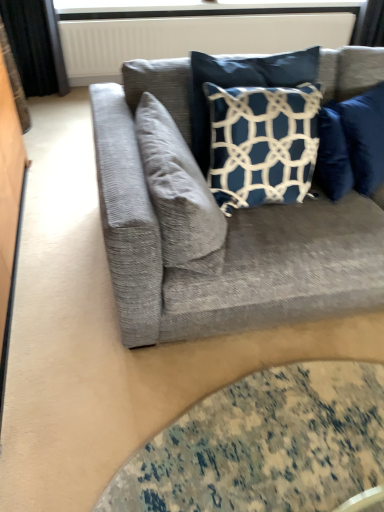
What are the coordinates of `white textured pillow at center, marked as the second pillow in a right-to-left arrangement` in the screenshot? It's located at (179, 193).

Measure the distance between point (205, 216) and camera.

Point (205, 216) and camera are 4.26 feet apart from each other.

Identify the location of textured gray couch at center. The image size is (384, 512). (226, 240).

Image resolution: width=384 pixels, height=512 pixels. Find the location of `navy blue fabric pillow at upper right, which is counted as the second pillow, starting from the left`. navy blue fabric pillow at upper right, which is counted as the second pillow, starting from the left is located at coordinates (240, 85).

Looking at this image, is white plastic window screen at upper center not inside textured gray couch at center?

Indeed, white plastic window screen at upper center is completely outside textured gray couch at center.

Is white plastic window screen at upper center looking in the opposite direction of textured gray couch at center?

No, textured gray couch at center is not at the back of white plastic window screen at upper center.

Considering the positions of points (309, 8) and (329, 289), is point (309, 8) farther from camera compared to point (329, 289)?

Yes, point (309, 8) is behind point (329, 289).

Is white textured pillow at center, marked as the second pillow in a right-to-left arrangement, taller or shorter than white textured radiator at upper center?

white textured pillow at center, marked as the second pillow in a right-to-left arrangement, is shorter than white textured radiator at upper center.

Is white textured pillow at center, marked as the second pillow in a right-to-left arrangement, in contact with white textured radiator at upper center?

They are not placed beside each other.

Which object is positioned more to the right, white textured pillow at center, marked as the second pillow in a right-to-left arrangement, or white textured radiator at upper center?

white textured radiator at upper center.

Is point (204, 233) positioned after point (196, 42)?

No, it is in front of (196, 42).

From a real-world perspective, who is located lower, textured gray couch at center or navy blue fabric pillow at upper right, which is counted as the second pillow, starting from the left?

textured gray couch at center is physically lower.

Looking at their sizes, would you say textured gray couch at center is wider or thinner than navy blue fabric pillow at upper right, marked as the first pillow in a right-to-left arrangement?

In the image, textured gray couch at center appears to be wider than navy blue fabric pillow at upper right, marked as the first pillow in a right-to-left arrangement.

You are a GUI agent. You are given a task and a screenshot of the screen. Output one action in this format:
    pyautogui.click(x=<x>, y=<y>)
    Task: Click on the pillow above the textured gray couch at center (from the image's perspective)
    This screenshot has height=512, width=384.
    Given the screenshot: What is the action you would take?
    pyautogui.click(x=240, y=85)

Considering the sizes of objects textured gray couch at center and navy blue fabric pillow at upper right, which is counted as the second pillow, starting from the left, in the image provided, who is taller, textured gray couch at center or navy blue fabric pillow at upper right, which is counted as the second pillow, starting from the left,?

textured gray couch at center.

Are white textured pillow at center, marked as the second pillow in a right-to-left arrangement, and black fabric curtain at left located far from each other?

Absolutely, white textured pillow at center, marked as the second pillow in a right-to-left arrangement, is distant from black fabric curtain at left.

From a real-world perspective, is white textured pillow at center, marked as the second pillow in a right-to-left arrangement, physically below black fabric curtain at left?

No, from a real-world perspective, white textured pillow at center, marked as the second pillow in a right-to-left arrangement, is not under black fabric curtain at left.

Is white textured pillow at center, positioned as the 1th pillow in left-to-right order, bigger than black fabric curtain at left?

Actually, white textured pillow at center, positioned as the 1th pillow in left-to-right order, might be smaller than black fabric curtain at left.

Is white textured pillow at center, marked as the second pillow in a right-to-left arrangement, oriented away from black fabric curtain at left?

No, white textured pillow at center, marked as the second pillow in a right-to-left arrangement, is not facing the opposite direction of black fabric curtain at left.

From the image's perspective, is white textured pillow at center, positioned as the 1th pillow in left-to-right order, located beneath transparent glass table at lower center?

Actually, white textured pillow at center, positioned as the 1th pillow in left-to-right order, appears above transparent glass table at lower center in the image.

Is white textured pillow at center, marked as the second pillow in a right-to-left arrangement, oriented towards transparent glass table at lower center?

No, white textured pillow at center, marked as the second pillow in a right-to-left arrangement, is not turned towards transparent glass table at lower center.

Based on the photo, in terms of height, does white textured pillow at center, marked as the second pillow in a right-to-left arrangement, look taller or shorter compared to transparent glass table at lower center?

Clearly, white textured pillow at center, marked as the second pillow in a right-to-left arrangement, is taller compared to transparent glass table at lower center.

Can we say transparent glass table at lower center lies outside white textured radiator at upper center?

Yes, transparent glass table at lower center is outside of white textured radiator at upper center.

From the image's perspective, would you say transparent glass table at lower center is shown under white textured radiator at upper center?

Yes.

How much distance is there between transparent glass table at lower center and white textured radiator at upper center?

transparent glass table at lower center is 2.81 meters from white textured radiator at upper center.

Considering the sizes of objects transparent glass table at lower center and white textured radiator at upper center in the image provided, who is smaller, transparent glass table at lower center or white textured radiator at upper center?

With smaller size is transparent glass table at lower center.

Is navy blue fabric pillow at upper right, marked as the first pillow in a right-to-left arrangement, positioned with its back to white textured radiator at upper center?

Yes.

In order to click on radiator above the navy blue fabric pillow at upper right, which is counted as the second pillow, starting from the left (from the image's perspective) in this screenshot , I will do `click(189, 37)`.

Is navy blue fabric pillow at upper right, which is counted as the second pillow, starting from the left, to the right of white textured radiator at upper center from the viewer's perspective?

Correct, you'll find navy blue fabric pillow at upper right, which is counted as the second pillow, starting from the left, to the right of white textured radiator at upper center.

How many degrees apart are the facing directions of navy blue fabric pillow at upper right, marked as the first pillow in a right-to-left arrangement, and white textured radiator at upper center?

There is a 0.11-degree angle between the facing directions of navy blue fabric pillow at upper right, marked as the first pillow in a right-to-left arrangement, and white textured radiator at upper center.

This screenshot has height=512, width=384. Identify the location of studio couch on the right of white plastic window screen at upper center. (226, 240).

Locate an element on the screen. radiator above the white textured pillow at center, marked as the second pillow in a right-to-left arrangement (from the image's perspective) is located at coordinates (189, 37).

Looking at the image, which one is located further to white plastic window screen at upper center, black fabric curtain at left or textured gray couch at center?

textured gray couch at center.

From the picture: Based on their spatial positions, is transparent glass table at lower center or white textured pillow at center, marked as the second pillow in a right-to-left arrangement, closer to navy blue fabric pillow at upper right, marked as the first pillow in a right-to-left arrangement?

white textured pillow at center, marked as the second pillow in a right-to-left arrangement, is positioned closer to the anchor navy blue fabric pillow at upper right, marked as the first pillow in a right-to-left arrangement.

Based on their spatial positions, is white textured pillow at center, positioned as the 1th pillow in left-to-right order, or white textured radiator at upper center further from transparent glass table at lower center?

white textured radiator at upper center.

Estimate the real-world distances between objects in this image. Which object is closer to textured gray couch at center, black fabric curtain at left or white plastic window screen at upper center?

black fabric curtain at left lies closer to textured gray couch at center than the other object.

Based on their spatial positions, is white textured pillow at center, positioned as the 1th pillow in left-to-right order, or white textured radiator at upper center closer to white plastic window screen at upper center?

white textured radiator at upper center is closer to white plastic window screen at upper center.

Consider the image. When comparing their distances from black fabric curtain at left, does textured gray couch at center or navy blue fabric pillow at upper right, which is counted as the second pillow, starting from the left, seem further?

textured gray couch at center is further to black fabric curtain at left.

Estimate the real-world distances between objects in this image. Which object is closer to white textured radiator at upper center, navy blue fabric pillow at upper right, marked as the first pillow in a right-to-left arrangement, or white plastic window screen at upper center?

Among the two, white plastic window screen at upper center is located nearer to white textured radiator at upper center.

Looking at this image, looking at the image, which one is located further to white textured radiator at upper center, navy blue fabric pillow at upper right, marked as the first pillow in a right-to-left arrangement, or black fabric curtain at left?

Among the two, navy blue fabric pillow at upper right, marked as the first pillow in a right-to-left arrangement, is located further to white textured radiator at upper center.

You are a GUI agent. You are given a task and a screenshot of the screen. Output one action in this format:
    pyautogui.click(x=<x>, y=<y>)
    Task: Click on the curtain positioned between navy blue fabric pillow at upper right, marked as the first pillow in a right-to-left arrangement, and white plastic window screen at upper center from near to far
    The image size is (384, 512).
    Given the screenshot: What is the action you would take?
    (35, 46)

Find the location of a particular element. pillow between white textured pillow at center, positioned as the 1th pillow in left-to-right order, and white textured radiator at upper center in the front-back direction is located at coordinates (240, 85).

In order to click on radiator located between black fabric curtain at left and white plastic window screen at upper center in the left-right direction in this screenshot , I will do `click(189, 37)`.

This screenshot has height=512, width=384. What are the coordinates of `radiator between white plastic window screen at upper center and transparent glass table at lower center in the vertical direction` in the screenshot? It's located at (189, 37).